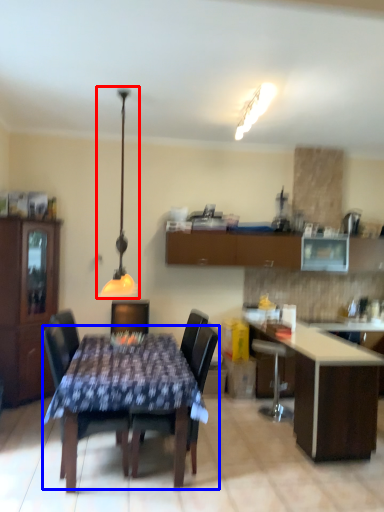
Question: Among these objects, which one is nearest to the camera, lamp (highlighted by a red box) or kitchen & dining room table (highlighted by a blue box)?

Choices:
 (A) lamp
 (B) kitchen & dining room table

Answer: (B)